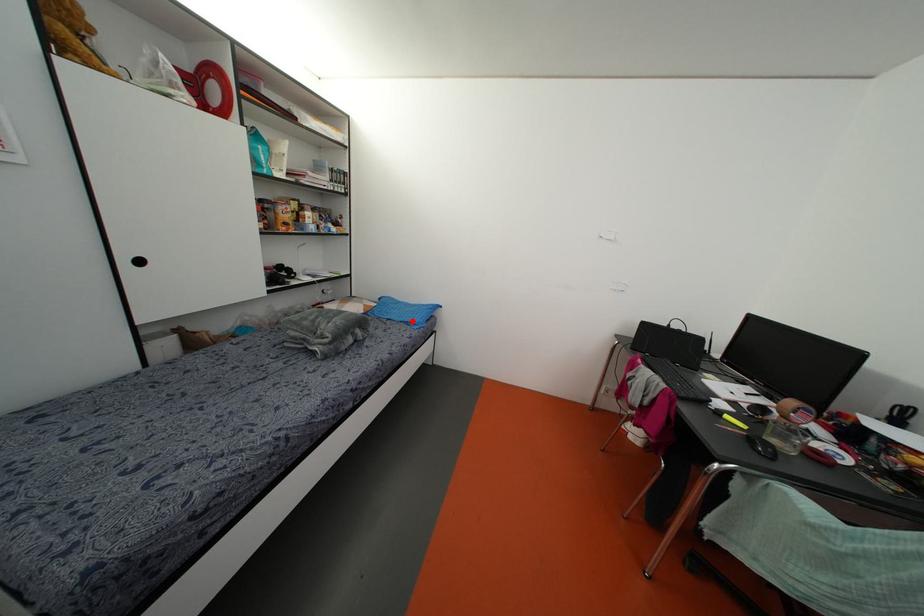
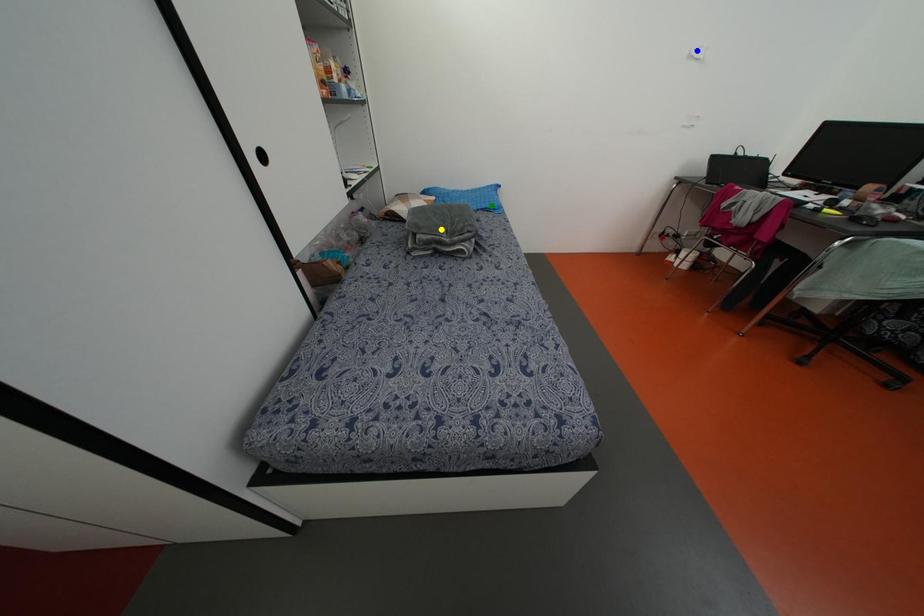
Question: I am providing you with two images of the same scene from different viewpoints. A red point is marked on the first image. You are given multiple points on the second image. Which mark in image 2 goes with the point in image 1?

Choices:
 (A) blue point
 (B) green point
 (C) yellow point

Answer: (B)